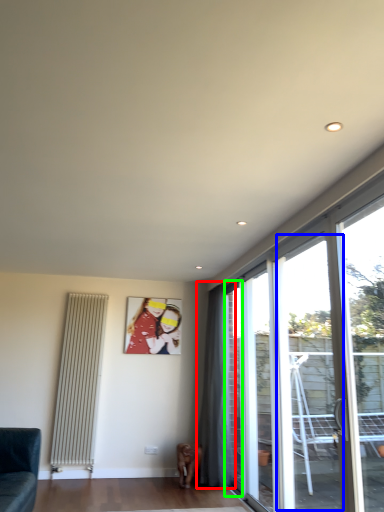
Question: Considering the real-world distances, which object is closest to curtain (highlighted by a red box)? window (highlighted by a blue box) or window (highlighted by a green box).

Choices:
 (A) window
 (B) window

Answer: (B)